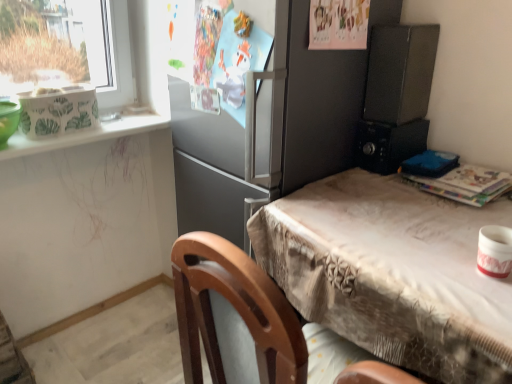
Where is `beige fabric table at center`? beige fabric table at center is located at coordinates (392, 273).

Image resolution: width=512 pixels, height=384 pixels. In order to click on white glossy window sill at upper left in this screenshot , I will do `click(82, 135)`.

In order to face white glossy mug at upper right, placed as the 1th appliance when sorted from front to back, should I rotate leftwards or rightwards?

Turn right approximately 29.913 degrees to face it.

Where is `beige fabric table at center`? This screenshot has width=512, height=384. beige fabric table at center is located at coordinates (392, 273).

Is beige fabric table at center bigger than white glossy window sill at upper left?

Correct, beige fabric table at center is larger in size than white glossy window sill at upper left.

Is beige fabric table at center turned away from white glossy window sill at upper left?

beige fabric table at center does not have its back to white glossy window sill at upper left.

Considering their positions, is beige fabric table at center located in front of or behind white glossy window sill at upper left?

beige fabric table at center is in front of white glossy window sill at upper left.

Which is nearer, [264,218] or [88,140]?

The point [264,218] is more forward.

Is matte black microwave at upper right, positioned as the 3th appliance in bottom-to-top order, turned away from black plastic microwave at right, which appears as the 1th appliance when viewed from the back?

That's not correct — matte black microwave at upper right, positioned as the 3th appliance in bottom-to-top order, is not looking away from black plastic microwave at right, which appears as the 1th appliance when viewed from the back.

How different are the orientations of matte black microwave at upper right, positioned as the 3th appliance in bottom-to-top order, and black plastic microwave at right, which is the second appliance in top-to-bottom order, in degrees?

The angular difference between matte black microwave at upper right, positioned as the 3th appliance in bottom-to-top order, and black plastic microwave at right, which is the second appliance in top-to-bottom order, is 9.57 degrees.

Between matte black microwave at upper right, placed as the second appliance when sorted from back to front, and black plastic microwave at right, which appears as the 1th appliance when viewed from the back, which one appears on the right side from the viewer's perspective?

From the viewer's perspective, matte black microwave at upper right, placed as the second appliance when sorted from back to front, appears more on the right side.

Considering the sizes of objects matte black microwave at upper right, positioned as the 3th appliance in bottom-to-top order, and black plastic microwave at right, which is the second appliance in top-to-bottom order, in the image provided, who is shorter, matte black microwave at upper right, positioned as the 3th appliance in bottom-to-top order, or black plastic microwave at right, which is the second appliance in top-to-bottom order,?

black plastic microwave at right, which is the second appliance in top-to-bottom order, is shorter.

Between satin gray refrigerator at center and white glossy window sill at upper left, which one has larger size?

satin gray refrigerator at center is bigger.

From a real-world perspective, is satin gray refrigerator at center under white glossy window sill at upper left?

Indeed, from a real-world perspective, satin gray refrigerator at center is positioned beneath white glossy window sill at upper left.

Measure the distance from satin gray refrigerator at center to white glossy window sill at upper left.

They are 51.92 centimeters apart.

Considering the relative positions of satin gray refrigerator at center and white glossy window sill at upper left in the image provided, is satin gray refrigerator at center to the left or to the right of white glossy window sill at upper left?

satin gray refrigerator at center is positioned on white glossy window sill at upper left's right side.

Does point (289, 236) come closer to viewer compared to point (325, 154)?

Yes, point (289, 236) is in front of point (325, 154).

Considering the sizes of objects beige fabric table at center and satin gray refrigerator at center in the image provided, who is bigger, beige fabric table at center or satin gray refrigerator at center?

With larger size is satin gray refrigerator at center.

Would you consider beige fabric table at center to be distant from satin gray refrigerator at center?

No.

How different are the orientations of beige fabric table at center and satin gray refrigerator at center in degrees?

They differ by 0.723 degrees in their facing directions.

Is beige fabric table at center oriented away from matte black microwave at upper right, placed as the second appliance when sorted from back to front?

beige fabric table at center is not turned away from matte black microwave at upper right, placed as the second appliance when sorted from back to front.

Is beige fabric table at center at the left side of matte black microwave at upper right, placed as the second appliance when sorted from back to front?

Yes.

From a real-world perspective, is beige fabric table at center physically above matte black microwave at upper right, the first appliance when ordered from top to bottom?

No, from a real-world perspective, beige fabric table at center is not over matte black microwave at upper right, the first appliance when ordered from top to bottom

From the image's perspective, is beige fabric table at center over matte black microwave at upper right, placed as the second appliance when sorted from back to front?

No.

The height and width of the screenshot is (384, 512). I want to click on fridge located on the left of black plastic microwave at right, which appears as the 1th appliance when viewed from the back, so click(x=266, y=129).

Does black plastic microwave at right, marked as the third appliance in a front-to-back arrangement, contain satin gray refrigerator at center?

No.

Is black plastic microwave at right, marked as the third appliance in a front-to-back arrangement, next to satin gray refrigerator at center and touching it?

There is a gap between black plastic microwave at right, marked as the third appliance in a front-to-back arrangement, and satin gray refrigerator at center.

Does satin gray refrigerator at center have a lesser width compared to matte black microwave at upper right, positioned as the 3th appliance in bottom-to-top order?

No, satin gray refrigerator at center is not thinner than matte black microwave at upper right, positioned as the 3th appliance in bottom-to-top order.

Considering the points (318, 131) and (409, 66), which point is in front, point (318, 131) or point (409, 66)?

Positioned in front is point (409, 66).

In the image, is satin gray refrigerator at center on the left side or the right side of matte black microwave at upper right, the 2th appliance viewed from the front?

satin gray refrigerator at center is positioned on matte black microwave at upper right, the 2th appliance viewed from the front,'s left side.

Find the location of a particular element. window sill on the left of beige fabric table at center is located at coordinates (82, 135).

From a real-world perspective, which appliance is the 1st one underneath the matte black microwave at upper right, positioned as the 3th appliance in bottom-to-top order? Please provide its 2D coordinates.

[(389, 144)]

Based on their spatial positions, is white glossy mug at upper right, which is the third appliance in back-to-front order, or beige fabric table at center further from matte black microwave at upper right, positioned as the 3th appliance in bottom-to-top order?

white glossy mug at upper right, which is the third appliance in back-to-front order.

Looking at the image, which one is located closer to black plastic microwave at right, marked as the third appliance in a front-to-back arrangement, satin gray refrigerator at center or white glossy window sill at upper left?

Based on the image, satin gray refrigerator at center appears to be nearer to black plastic microwave at right, marked as the third appliance in a front-to-back arrangement.

Estimate the real-world distances between objects in this image. Which object is further from satin gray refrigerator at center, black plastic microwave at right, which is the second appliance in top-to-bottom order, or white glossy mug at upper right, which ranks as the third appliance in top-to-bottom order?

The object further to satin gray refrigerator at center is white glossy mug at upper right, which ranks as the third appliance in top-to-bottom order.

Estimate the real-world distances between objects in this image. Which object is closer to white glossy window sill at upper left, white glossy mug at upper right, which is the third appliance in back-to-front order, or matte black microwave at upper right, the first appliance when ordered from top to bottom?

Based on the image, matte black microwave at upper right, the first appliance when ordered from top to bottom, appears to be nearer to white glossy window sill at upper left.

Looking at the image, which one is located further to beige fabric table at center, satin gray refrigerator at center or matte black microwave at upper right, the 2th appliance viewed from the front?

Among the two, matte black microwave at upper right, the 2th appliance viewed from the front, is located further to beige fabric table at center.

Based on their spatial positions, is satin gray refrigerator at center or black plastic microwave at right, marked as the third appliance in a front-to-back arrangement, closer to matte black microwave at upper right, the 2th appliance viewed from the front?

Among the two, black plastic microwave at right, marked as the third appliance in a front-to-back arrangement, is located nearer to matte black microwave at upper right, the 2th appliance viewed from the front.

Estimate the real-world distances between objects in this image. Which object is closer to black plastic microwave at right, which is the second appliance in bottom-to-top order, satin gray refrigerator at center or white glossy mug at upper right, which ranks as the third appliance in top-to-bottom order?

satin gray refrigerator at center lies closer to black plastic microwave at right, which is the second appliance in bottom-to-top order, than the other object.

Which object lies further to the anchor point white glossy mug at upper right, which is the third appliance in back-to-front order, beige fabric table at center or white glossy window sill at upper left?

white glossy window sill at upper left lies further to white glossy mug at upper right, which is the third appliance in back-to-front order, than the other object.

The width and height of the screenshot is (512, 384). I want to click on fridge between white glossy window sill at upper left and beige fabric table at center in the horizontal direction, so click(266, 129).

Locate an element on the screen. table between white glossy window sill at upper left and black plastic microwave at right, which appears as the 1th appliance when viewed from the back, from left to right is located at coordinates (392, 273).

Identify the location of appliance between white glossy window sill at upper left and matte black microwave at upper right, placed as the second appliance when sorted from back to front, in the horizontal direction. Image resolution: width=512 pixels, height=384 pixels. (389, 144).

Locate an element on the screen. The image size is (512, 384). table situated between white glossy window sill at upper left and matte black microwave at upper right, positioned as the 3th appliance in bottom-to-top order, from left to right is located at coordinates (392, 273).